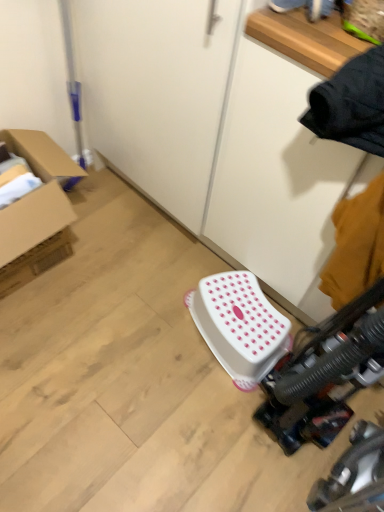
Find the location of a particular element. free spot in front of cardboard box at left is located at coordinates (52, 335).